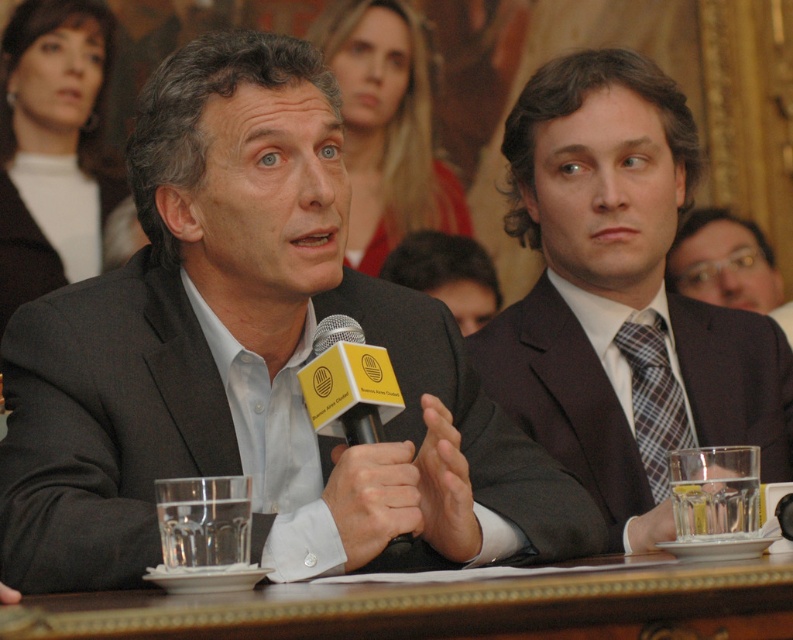
You are organizing a meeting and need to place a 2.5 meters long banner on the table. Given the brown wooden table at center and the plaid fabric tie at right, can the banner fit on the table?

The brown wooden table at center is wider than the plaid fabric tie at right. However, the banner is 2.5 meters long, and the table width is not provided. Therefore, it is impossible to determine if the banner will fit based on the given information.

You are a photographer setting up for a group photo. You need to position two subjects so that there is at least 1 meter between them. Given the current positions of the plaid fabric tie at right and the matte black suit at center, will they need to move closer or farther apart to meet the requirement?

The distance between the plaid fabric tie at right and the matte black suit at center is currently 1.37 meters. Since the requirement is at least 1 meter, they do not need to move closer. However, if the requirement is exactly 1 meter, they would need to move closer, but since it specifies at least 1 meter, their current distance meets the requirement. Therefore, they do not need to move.